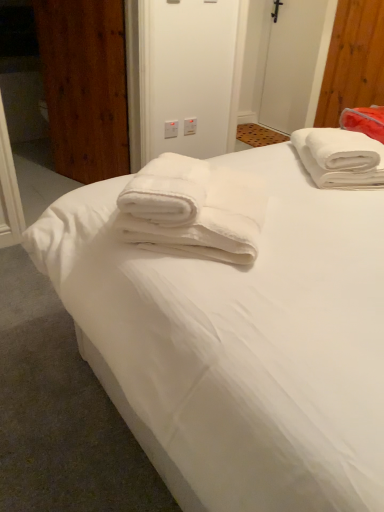
Question: Is white soft towel at center inside white plastic electric outlet at upper center, acting as the 2th electric outlet starting from the left?

Choices:
 (A) no
 (B) yes

Answer: (A)

Question: Considering the relative sizes of white plastic electric outlet at upper center, acting as the first electric outlet starting from the right, and white soft towel at center in the image provided, is white plastic electric outlet at upper center, acting as the first electric outlet starting from the right, bigger than white soft towel at center?

Choices:
 (A) yes
 (B) no

Answer: (B)

Question: From the image's perspective, does white plastic electric outlet at upper center, acting as the first electric outlet starting from the right, appear lower than white soft towel at center?

Choices:
 (A) yes
 (B) no

Answer: (B)

Question: Considering the relative positions of white plastic electric outlet at upper center, acting as the 2th electric outlet starting from the left, and white soft towel at center in the image provided, is white plastic electric outlet at upper center, acting as the 2th electric outlet starting from the left, to the left of white soft towel at center from the viewer's perspective?

Choices:
 (A) no
 (B) yes

Answer: (B)

Question: From a real-world perspective, does white plastic electric outlet at upper center, acting as the first electric outlet starting from the right, sit lower than white soft towel at center?

Choices:
 (A) yes
 (B) no

Answer: (A)

Question: Does white plastic electric outlet at upper center, acting as the 2th electric outlet starting from the left, come behind white soft towel at center?

Choices:
 (A) no
 (B) yes

Answer: (B)

Question: Does white plastic electric outlet at upper center, which is the 2th electric outlet in right-to-left order, have a greater width compared to white plastic screen door at upper center?

Choices:
 (A) no
 (B) yes

Answer: (A)

Question: Is white plastic screen door at upper center inside white plastic electric outlet at upper center, which is counted as the first electric outlet, starting from the left?

Choices:
 (A) no
 (B) yes

Answer: (A)

Question: From the image's perspective, is white plastic electric outlet at upper center, which is counted as the first electric outlet, starting from the left, on top of white plastic screen door at upper center?

Choices:
 (A) yes
 (B) no

Answer: (B)

Question: Considering the relative sizes of white plastic electric outlet at upper center, which is the 2th electric outlet in right-to-left order, and white plastic screen door at upper center in the image provided, is white plastic electric outlet at upper center, which is the 2th electric outlet in right-to-left order, smaller than white plastic screen door at upper center?

Choices:
 (A) no
 (B) yes

Answer: (B)

Question: Considering the relative sizes of white plastic electric outlet at upper center, which is counted as the first electric outlet, starting from the left, and white plastic screen door at upper center in the image provided, is white plastic electric outlet at upper center, which is counted as the first electric outlet, starting from the left, thinner than white plastic screen door at upper center?

Choices:
 (A) yes
 (B) no

Answer: (A)

Question: Is white plastic electric outlet at upper center, which is counted as the first electric outlet, starting from the left, at the right side of white plastic screen door at upper center?

Choices:
 (A) no
 (B) yes

Answer: (A)

Question: Is white plastic screen door at upper center bigger than white soft towel at upper right?

Choices:
 (A) no
 (B) yes

Answer: (B)